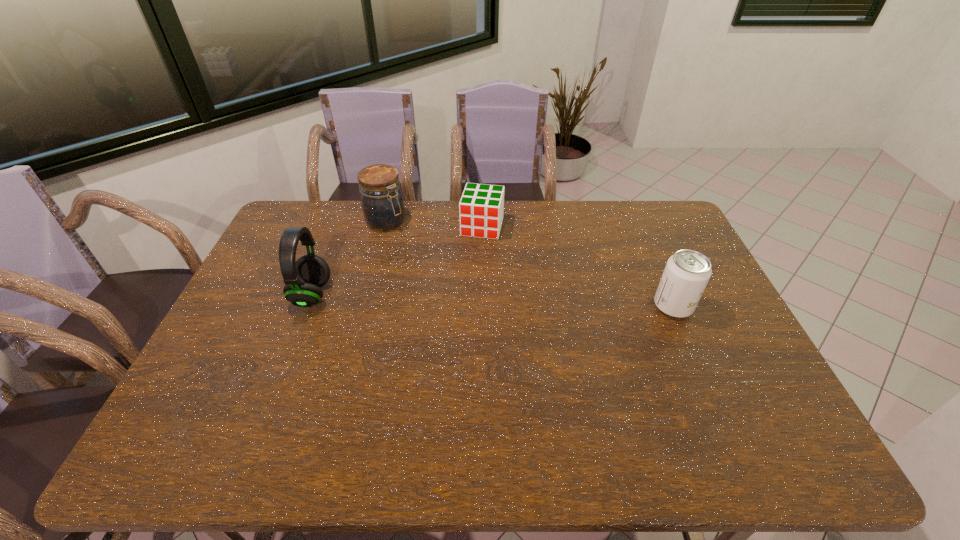
At what (x,y) coordinates should I click in order to perform the action: click on vacant space on the desktop that is between the leftmost object and the rightmost object and is positioned on the lid of the second object from left to right. Please return your answer as a coordinate pair (x, y). The height and width of the screenshot is (540, 960). Looking at the image, I should click on (492, 300).

Where is `vacant space on the desktop that is between the leftmost object and the soda can and is positioned on the red face of the third object from left to right`? vacant space on the desktop that is between the leftmost object and the soda can and is positioned on the red face of the third object from left to right is located at coordinates (463, 299).